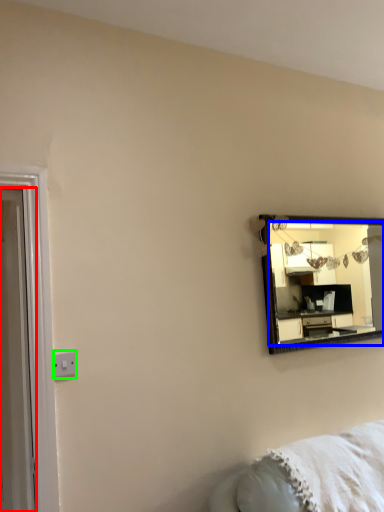
Question: Estimate the real-world distances between objects in this image. Which object is farther from door (highlighted by a red box), mirror (highlighted by a blue box) or electric outlet (highlighted by a green box)?

Choices:
 (A) mirror
 (B) electric outlet

Answer: (A)